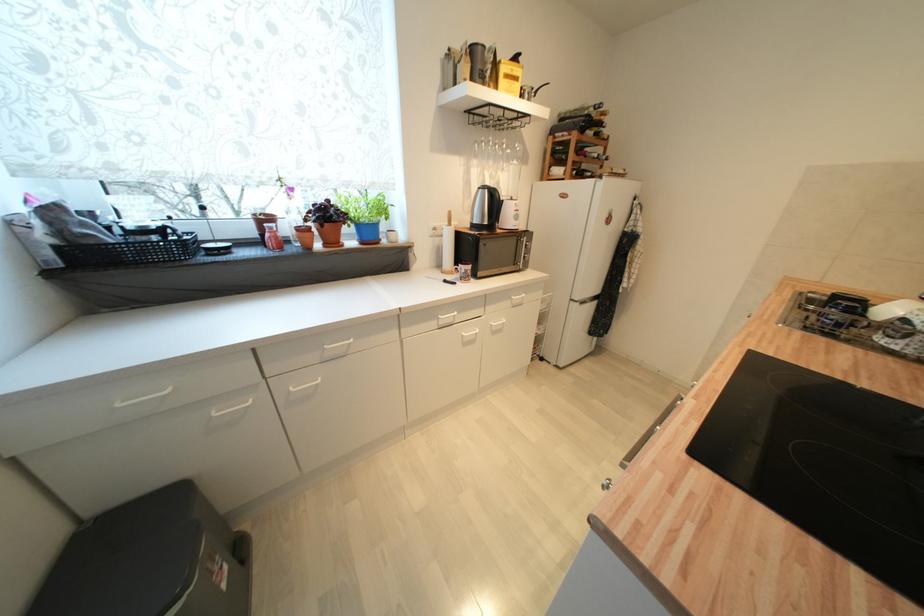
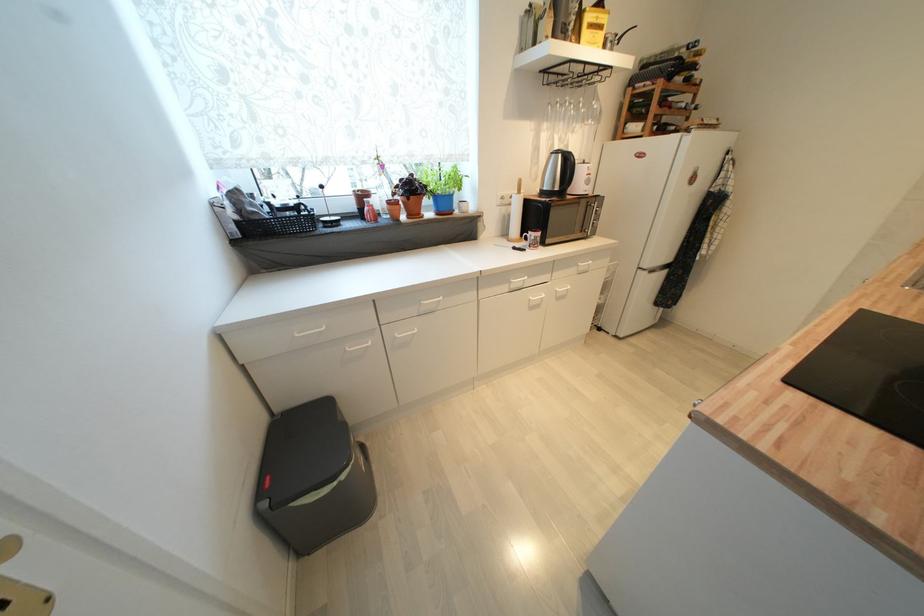
Where in the second image is the point corresponding to (502,318) from the first image?

(566, 285)